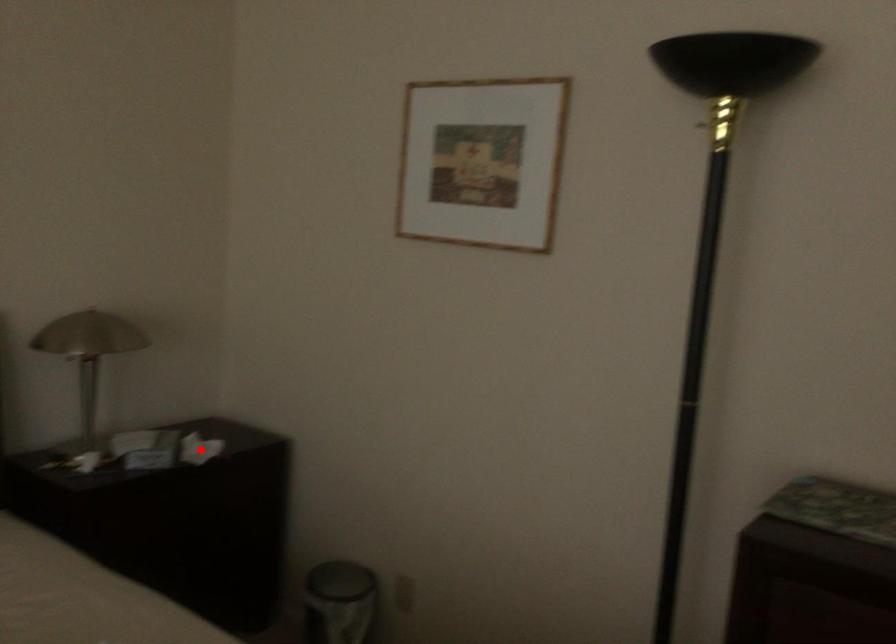
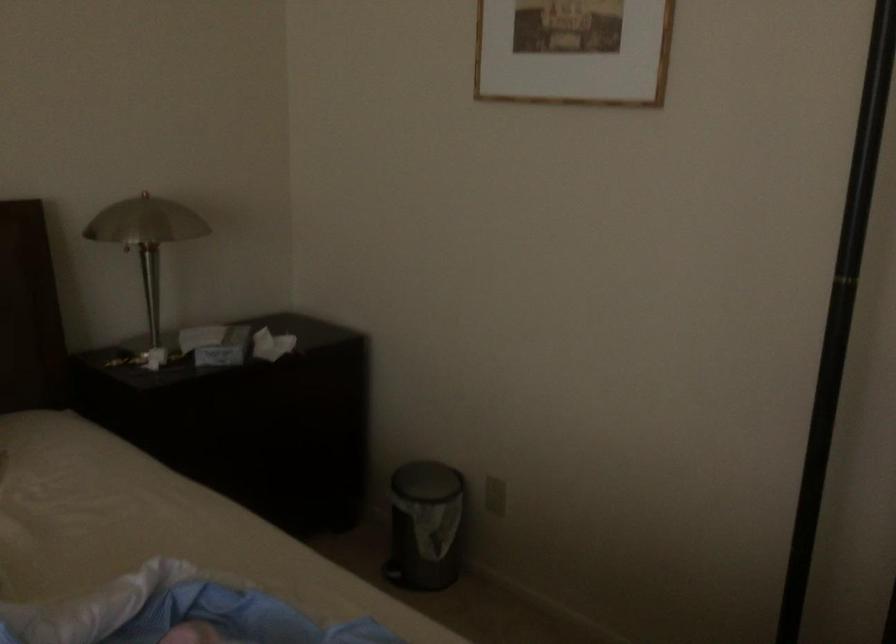
The point at the highlighted location is marked in the first image. Where is the corresponding point in the second image?

(271, 345)